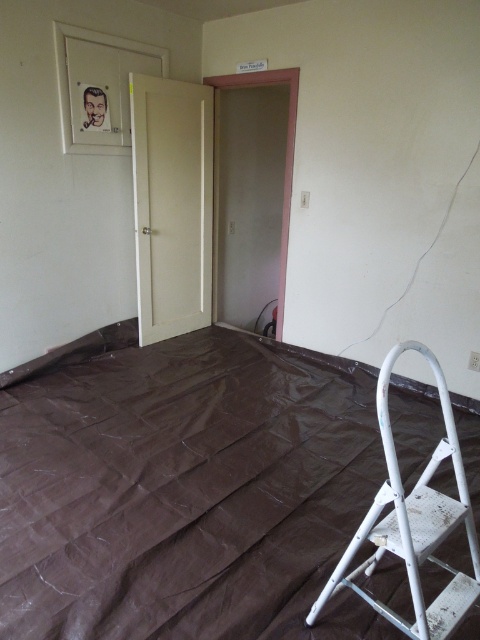
Does brown plastic sheet at lower right have a larger size compared to white matte step ladder at lower right?

Yes, brown plastic sheet at lower right is bigger than white matte step ladder at lower right.

Is brown plastic sheet at lower right wider than white matte step ladder at lower right?

Yes, brown plastic sheet at lower right is wider than white matte step ladder at lower right.

Is point (359, 512) less distant than point (455, 522)?

No, (359, 512) is behind (455, 522).

I want to click on brown plastic sheet at lower right, so click(182, 490).